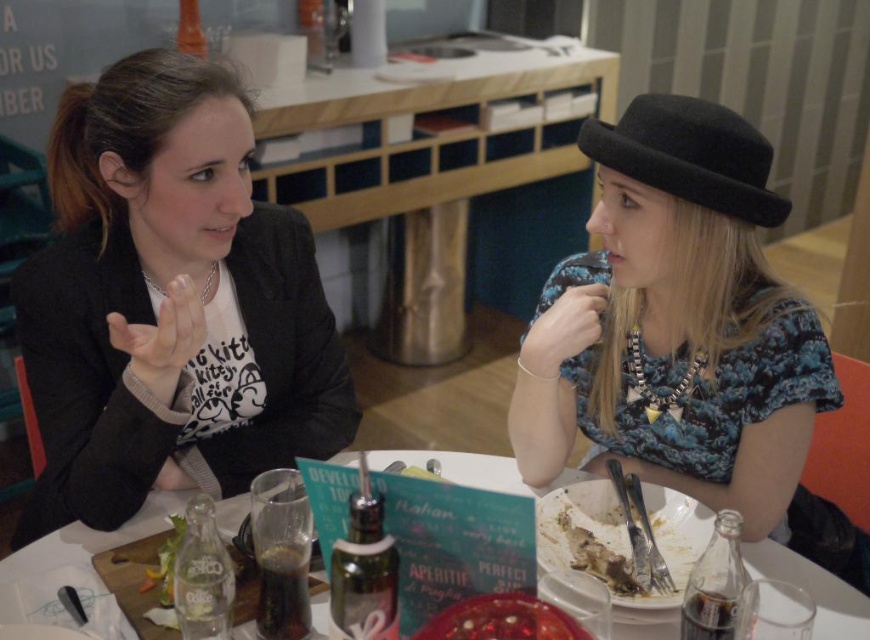
Does white glossy table at center appear under black felt plug hat at upper right?

Indeed, white glossy table at center is positioned under black felt plug hat at upper right.

Between white glossy table at center and black felt plug hat at upper right, which one appears on the right side from the viewer's perspective?

black felt plug hat at upper right

Between point (126, 636) and point (724, 157), which one is positioned behind?

The point (724, 157) is behind.

I want to click on white glossy table at center, so click(x=74, y=550).

Looking at this image, which of these two, matte black blazer at left or black felt plug hat at upper right, stands taller?

matte black blazer at left

Is point (65, 496) behind point (763, 177)?

Yes, point (65, 496) is farther from viewer.

Is point (248, 204) positioned before point (639, 115)?

No, it is behind (639, 115).

You are a GUI agent. You are given a task and a screenshot of the screen. Output one action in this format:
    pyautogui.click(x=<x>, y=<y>)
    Task: Click on the matte black blazer at left
    The height and width of the screenshot is (640, 870).
    Given the screenshot: What is the action you would take?
    pyautogui.click(x=169, y=304)

Which is behind, point (77, 128) or point (646, 275)?

Point (77, 128)

Is point (211, 266) less distant than point (543, 328)?

No.

Where is `matte black blazer at left`? The width and height of the screenshot is (870, 640). matte black blazer at left is located at coordinates coord(169,304).